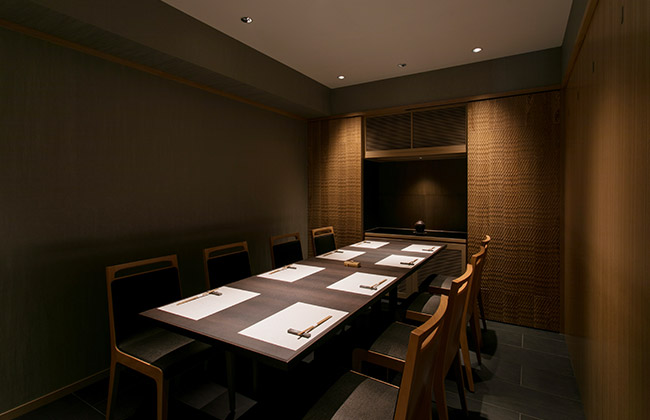
The width and height of the screenshot is (650, 420). I want to click on brown long rectangular table, so click(x=224, y=324).